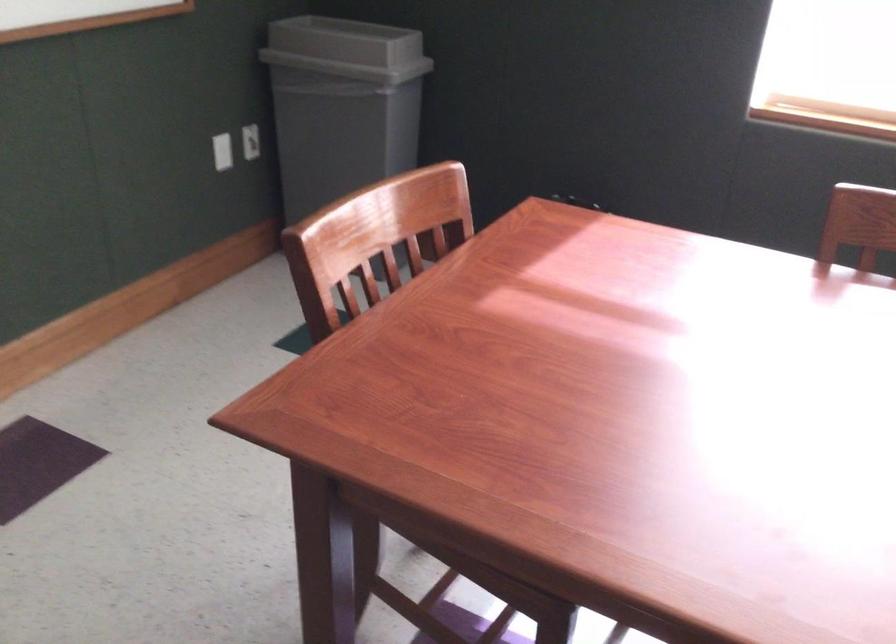
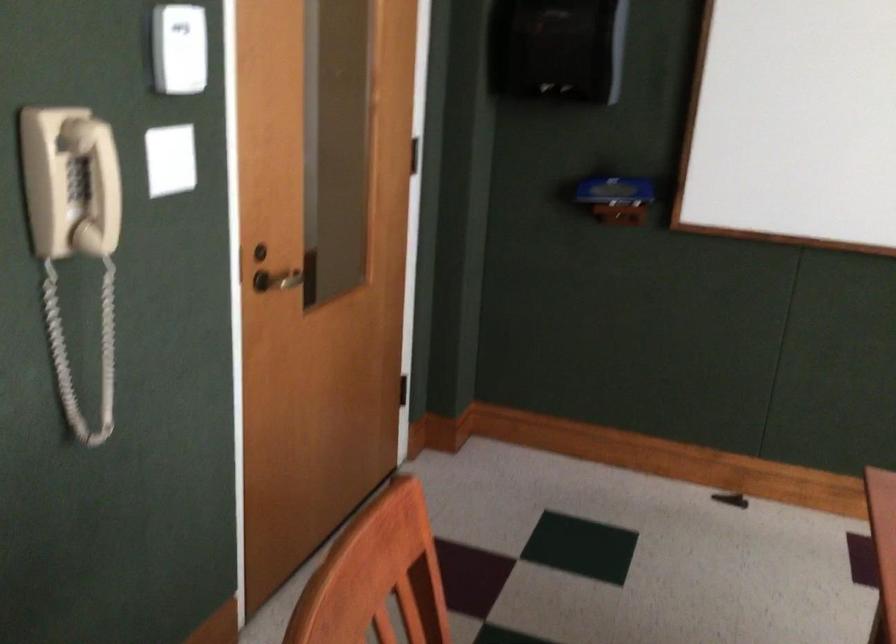
Question: The images are taken continuously from a first-person perspective. In which direction is your viewpoint rotating?

Choices:
 (A) Left
 (B) Right
 (C) Up
 (D) Down

Answer: (A)